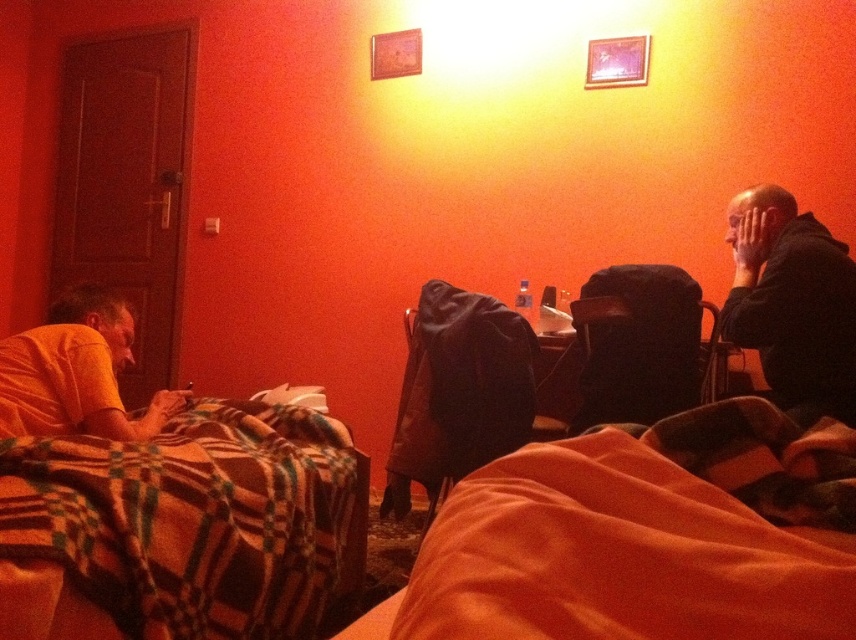
Question: Can you confirm if orange soft fabric blanket at lower right is bigger than plaid fabric blanket at lower left?

Choices:
 (A) yes
 (B) no

Answer: (B)

Question: Is orange soft fabric blanket at lower right to the right of black hoodie at right from the viewer's perspective?

Choices:
 (A) yes
 (B) no

Answer: (B)

Question: Which object appears farthest from the camera in this image?

Choices:
 (A) orange soft fabric blanket at lower right
 (B) black hoodie at right
 (C) plaid fabric blanket at lower left
 (D) black fabric chair at center

Answer: (D)

Question: Which of the following is the closest to the observer?

Choices:
 (A) yellow cotton shirt at left
 (B) orange soft fabric blanket at lower right
 (C) black hoodie at right

Answer: (B)

Question: Is plaid fabric blanket at lower left further to camera compared to yellow cotton shirt at left?

Choices:
 (A) no
 (B) yes

Answer: (A)

Question: Considering the real-world distances, which object is farthest from the black hoodie at right?

Choices:
 (A) yellow cotton shirt at left
 (B) black fabric chair at center
 (C) plaid fabric blanket at lower left

Answer: (A)